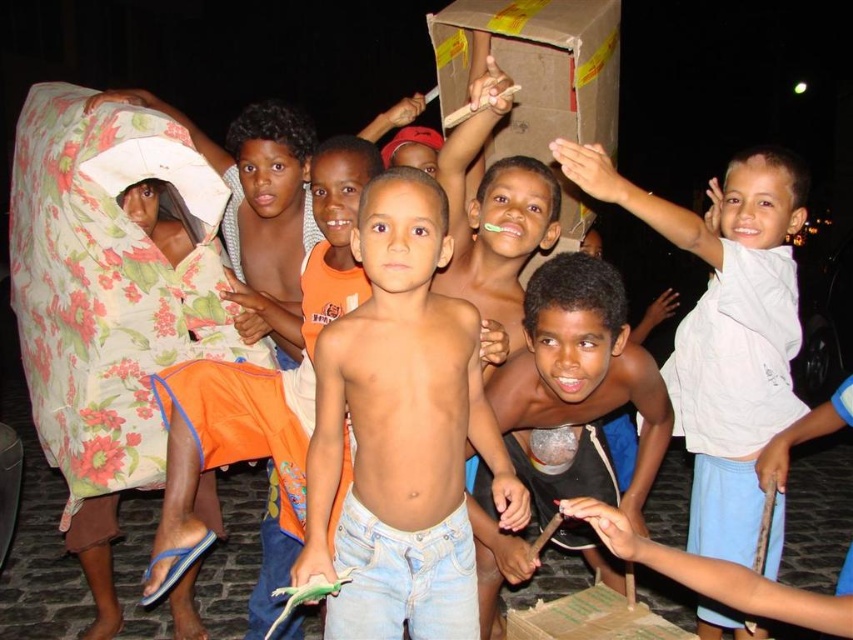
Does white cotton shirt at upper right have a greater height compared to cardboard box at center?

Correct, white cotton shirt at upper right is much taller as cardboard box at center.

Does white cotton shirt at upper right have a lesser height compared to cardboard box at center?

In fact, white cotton shirt at upper right may be taller than cardboard box at center.

Does point (770, 372) lie in front of point (648, 618)?

No, it is not.

You are a GUI agent. You are given a task and a screenshot of the screen. Output one action in this format:
    pyautogui.click(x=<x>, y=<y>)
    Task: Click on the white cotton shirt at upper right
    This screenshot has height=640, width=853.
    Given the screenshot: What is the action you would take?
    pyautogui.click(x=724, y=324)

Is point (374, 433) less distant than point (608, 397)?

Yes, it is in front of point (608, 397).

Can you confirm if light blue denim jeans at center is positioned to the left of shiny metallic cup at center?

Yes, light blue denim jeans at center is to the left of shiny metallic cup at center.

What do you see at coordinates (401, 433) in the screenshot? The width and height of the screenshot is (853, 640). I see `light blue denim jeans at center` at bounding box center [401, 433].

What are the coordinates of `light blue denim jeans at center` in the screenshot? It's located at (401, 433).

Between shiny metallic cup at center and cardboard box at center, which one appears on the left side from the viewer's perspective?

From the viewer's perspective, shiny metallic cup at center appears more on the left side.

Looking at this image, who is taller, shiny metallic cup at center or cardboard box at center?

With more height is shiny metallic cup at center.

Between point (495, 637) and point (567, 609), which one is positioned behind?

Point (495, 637)

Identify the location of shiny metallic cup at center. (577, 388).